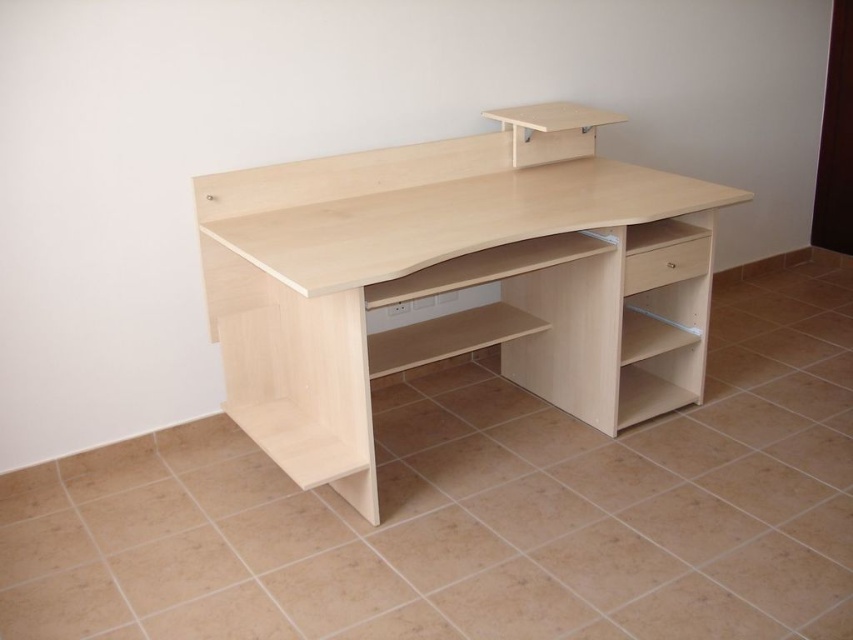
You are standing at the center of the room facing the desk. There are two points marked on the desk surface. The first point is at coordinates point (x=553, y=250) and the second is at point (x=677, y=243). If you were to move from the first point to the second point, would you be moving towards the wall or away from it?

Moving from point (x=553, y=250) to point (x=677, y=243) would mean moving away from the wall because point (x=677, y=243) is behind point (x=553, y=250) according to the spatial description provided.

In the scene shown: You are standing at the origin point of the room, which is at coordinates 0,0. The room has a coordinate system where the bottom left corner is 0,0 and the top right corner is 1,1. You need to place a new lamp on the wall directly behind the light wood computer desk at center. Where should you place the lamp in terms of coordinates?

The light wood computer desk at center is located at coordinates (448, 284). To place the lamp directly behind it on the wall, you should position it at the same x coordinate but at the maximum y coordinate of the room. Since the top right corner is (852, 639), the y coordinate would be 1. Therefore, the lamp should be placed at coordinates (852, 284).